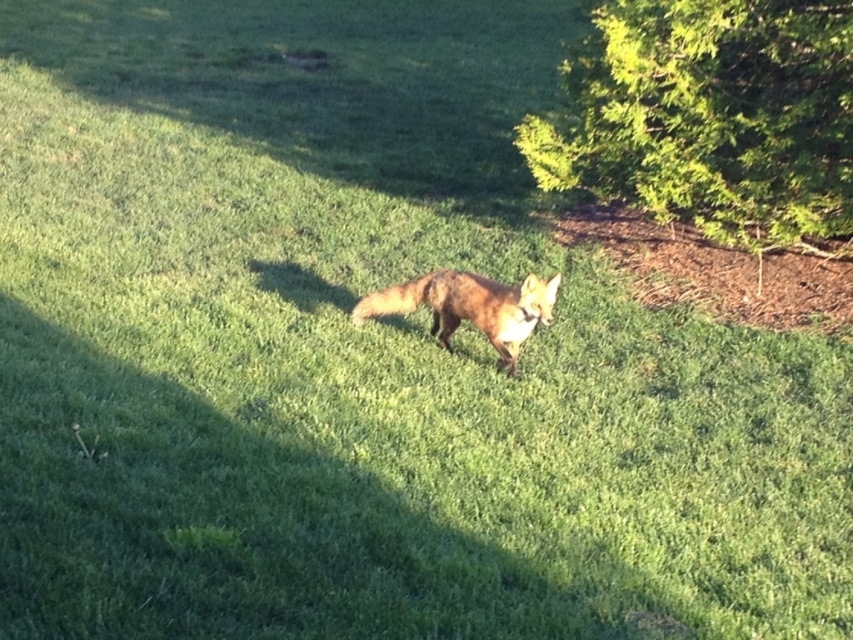
Who is more distant from viewer, (x=625, y=145) or (x=453, y=280)?

The point (x=625, y=145) is more distant.

Does point (560, 132) come farther from viewer compared to point (357, 317)?

Yes, it is.

Where is `green leafy bush at upper right`? green leafy bush at upper right is located at coordinates (711, 116).